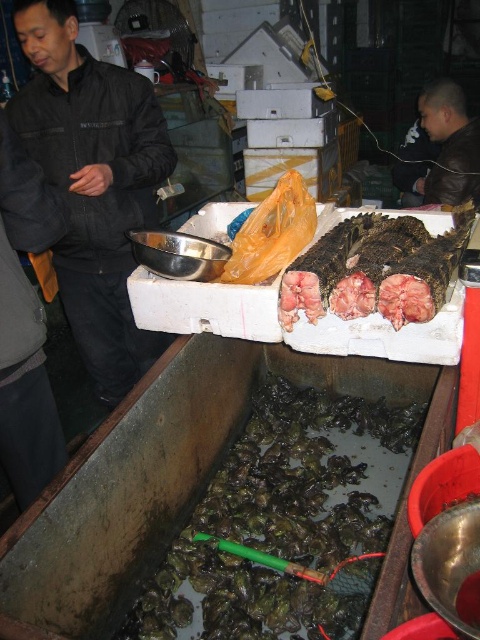
You are a customer at the seafood market and want to place a brown leather jacket at upper right on top of the dark brown textured fish at upper center. Will the fish be crushed by the jacket?

The dark brown textured fish at upper center has a lesser height compared to brown leather jacket at upper right. Since the fish is shorter, placing the jacket on top might crush it depending on the jacket weight and the fish structure.

You are a delivery person who needs to move the dark brown rubber oyster at lower left and the dark matte jacket at left into a storage room. The storage room has a narrow doorway that is 1.1 meters wide. Can both items be carried through the doorway together without needing to be separated?

The dark brown rubber oyster at lower left and dark matte jacket at left are 1.09 meters apart. Since the distance between them is less than the doorway width of 1.1 meters, they can be carried through the doorway together without separation.

You are a customer at the seafood market and want to buy both the dark brown textured fish at upper center and the brown leather jacket at upper right. However, you have a small cooler that can only fit items that are smaller than 12 inches in length. Can both items fit in your cooler?

The dark brown textured fish at upper center is bigger than the brown leather jacket at upper right. Since the cooler can only fit items smaller than 12 inches, if the fish is larger than 12 inches, it won but the jacket might fit. However, without exact measurements, it is uncertain if both will fit.